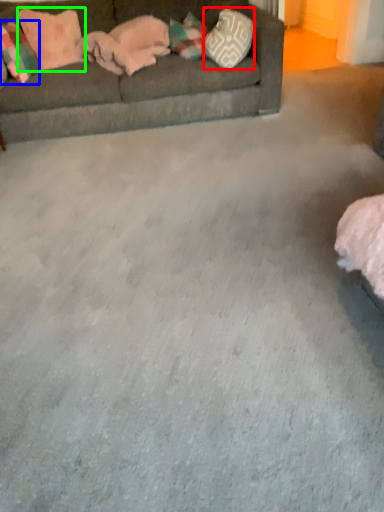
Question: Estimate the real-world distances between objects in this image. Which object is farther from pillow (highlighted by a red box), pillow (highlighted by a blue box) or pillow (highlighted by a green box)?

Choices:
 (A) pillow
 (B) pillow

Answer: (A)